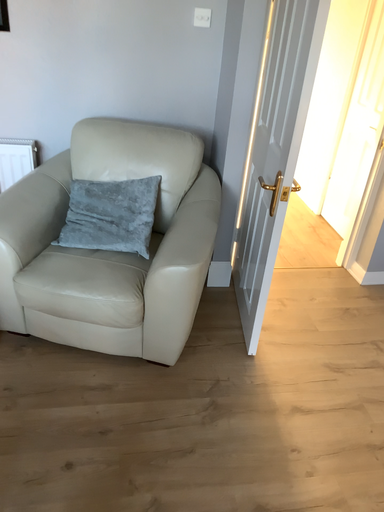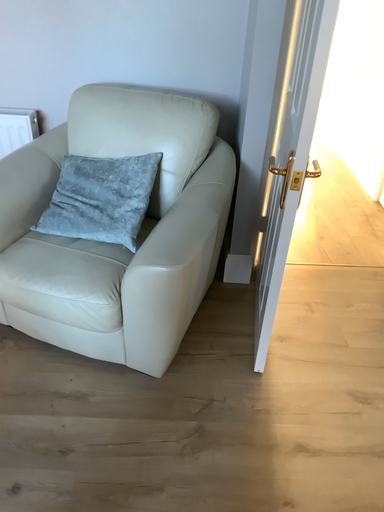
Question: Which way did the camera rotate in the video?

Choices:
 (A) rotated left
 (B) rotated right

Answer: (A)